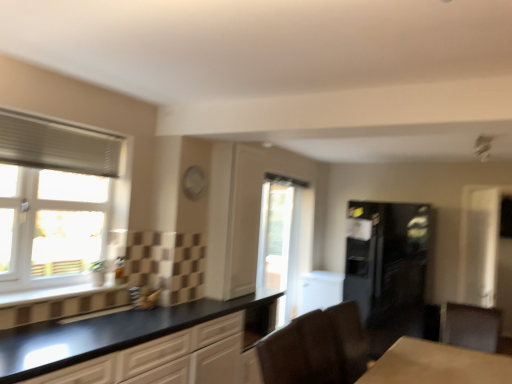
Question: Can you confirm if white pleated blind at upper left is shorter than transparent glass door at center, the first window viewed from the right?

Choices:
 (A) yes
 (B) no

Answer: (A)

Question: Does white pleated blind at upper left have a lesser width compared to transparent glass door at center, the first window viewed from the right?

Choices:
 (A) no
 (B) yes

Answer: (A)

Question: Is white pleated blind at upper left further to camera compared to transparent glass door at center, which is the 2th window in front-to-back order?

Choices:
 (A) no
 (B) yes

Answer: (A)

Question: Can you confirm if white pleated blind at upper left is smaller than transparent glass door at center, which appears as the first window when viewed from the back?

Choices:
 (A) no
 (B) yes

Answer: (B)

Question: Is white pleated blind at upper left outside transparent glass door at center, which appears as the first window when viewed from the back?

Choices:
 (A) no
 (B) yes

Answer: (B)

Question: Considering their positions, is matte black cabinet at lower right, which appears as the second cabinetry when viewed from the left, located in front of or behind white textured window at left, which is counted as the 1th window, starting from the front?

Choices:
 (A) behind
 (B) front

Answer: (A)

Question: In terms of size, does matte black cabinet at lower right, which ranks as the 1th cabinetry in right-to-left order, appear bigger or smaller than white textured window at left, which is counted as the 1th window, starting from the front?

Choices:
 (A) small
 (B) big

Answer: (B)

Question: From a real-world perspective, relative to white textured window at left, acting as the 2th window starting from the right, is matte black cabinet at lower right, which appears as the second cabinetry when viewed from the left, vertically above or below?

Choices:
 (A) above
 (B) below

Answer: (B)

Question: Considering the positions of matte black cabinet at lower right, which ranks as the 1th cabinetry in right-to-left order, and white textured window at left, acting as the 2th window starting from the right, in the image, is matte black cabinet at lower right, which ranks as the 1th cabinetry in right-to-left order, wider or thinner than white textured window at left, acting as the 2th window starting from the right,?

Choices:
 (A) thin
 (B) wide

Answer: (B)

Question: Considering the relative positions of white pleated blind at upper left and black matte cabinet at lower left, arranged as the 1th cabinetry when viewed from the left, in the image provided, is white pleated blind at upper left to the left or to the right of black matte cabinet at lower left, arranged as the 1th cabinetry when viewed from the left,?

Choices:
 (A) right
 (B) left

Answer: (B)

Question: Looking at their shapes, would you say white pleated blind at upper left is wider or thinner than black matte cabinet at lower left, arranged as the 1th cabinetry when viewed from the left?

Choices:
 (A) thin
 (B) wide

Answer: (A)

Question: Based on their sizes in the image, would you say white pleated blind at upper left is bigger or smaller than black matte cabinet at lower left, which is the second cabinetry from right to left?

Choices:
 (A) big
 (B) small

Answer: (B)

Question: Which is correct: white pleated blind at upper left is inside black matte cabinet at lower left, arranged as the 1th cabinetry when viewed from the left, or outside of it?

Choices:
 (A) inside
 (B) outside

Answer: (B)

Question: Based on their sizes in the image, would you say white glossy screen door at right is bigger or smaller than transparent glass door at center, which is the 2th window in front-to-back order?

Choices:
 (A) big
 (B) small

Answer: (B)

Question: In terms of width, does white glossy screen door at right look wider or thinner when compared to transparent glass door at center, the first window viewed from the right?

Choices:
 (A) thin
 (B) wide

Answer: (A)